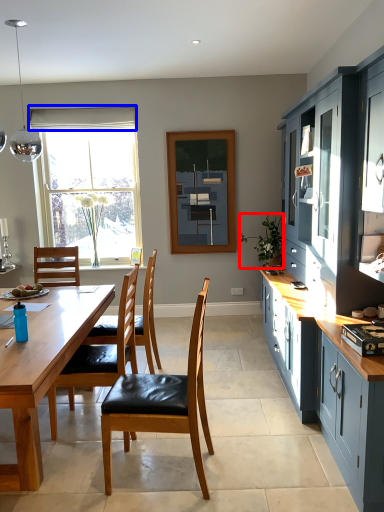
Question: Which object is closer to the camera taking this photo, houseplant (highlighted by a red box) or curtain (highlighted by a blue box)?

Choices:
 (A) houseplant
 (B) curtain

Answer: (A)